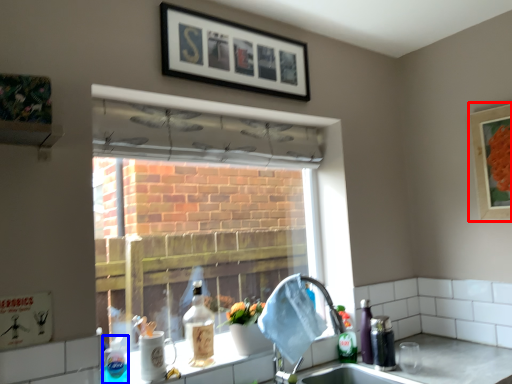
Question: Which of the following is the farthest to the observer, picture frame (highlighted by a red box) or bottle (highlighted by a blue box)?

Choices:
 (A) picture frame
 (B) bottle

Answer: (A)